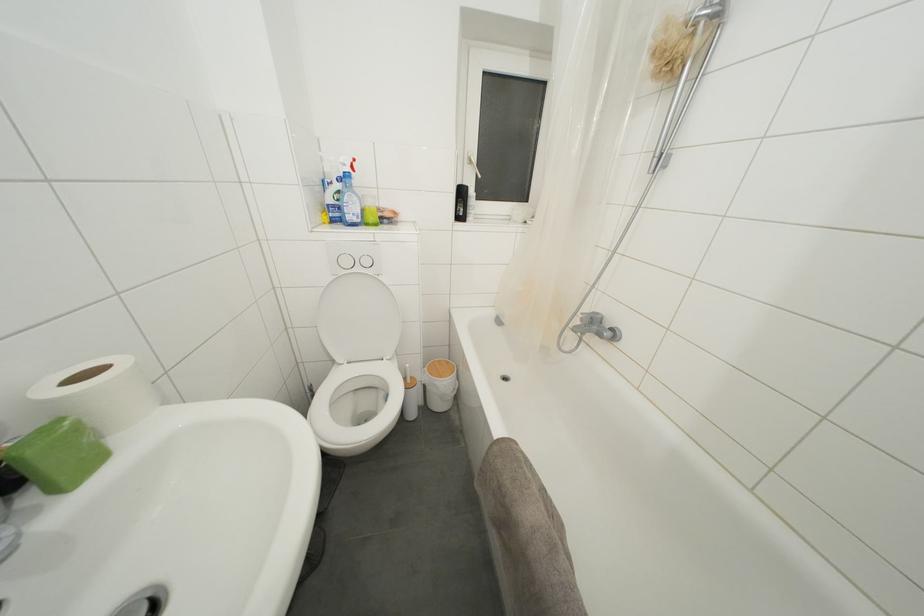
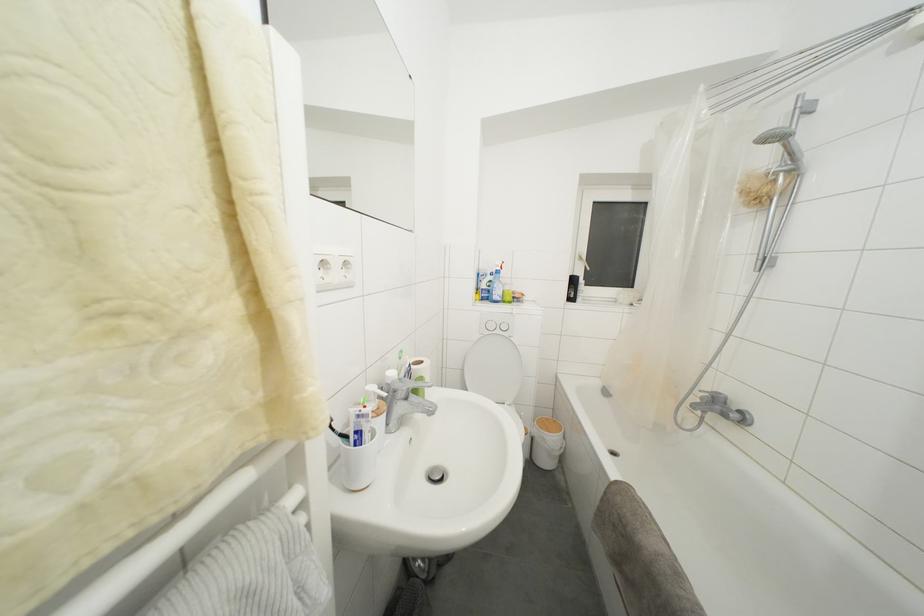
The point at (444, 366) is marked in the first image. Where is the corresponding point in the second image?

(552, 424)